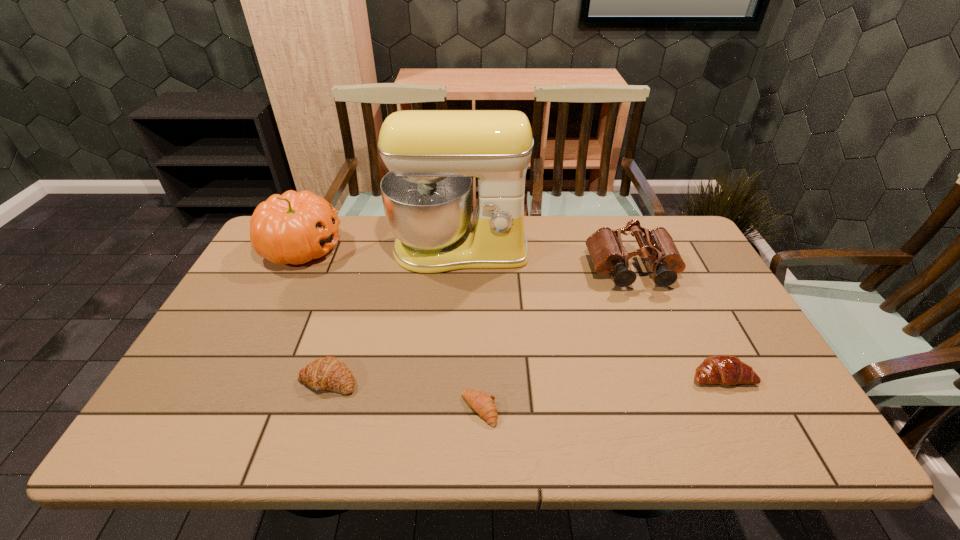
This screenshot has width=960, height=540. Find the location of `the tallest object`. the tallest object is located at coordinates (432, 155).

Locate an element on the screen. This screenshot has width=960, height=540. the fifth shortest object is located at coordinates (293, 228).

Locate an element on the screen. pumpkin is located at coordinates (293, 228).

This screenshot has height=540, width=960. What are the coordinates of `binoculars` in the screenshot? It's located at (608, 254).

Find the location of a particular element. The height and width of the screenshot is (540, 960). the second object from left to right is located at coordinates (329, 373).

Image resolution: width=960 pixels, height=540 pixels. What are the coordinates of `the rightmost crescent roll` in the screenshot? It's located at (720, 369).

Image resolution: width=960 pixels, height=540 pixels. In order to click on the shortest object in this screenshot , I will do `click(483, 404)`.

I want to click on the shortest crescent roll, so click(x=483, y=404).

The height and width of the screenshot is (540, 960). In order to click on free point located 0.210m on the side of the mixer with the control knob in this screenshot , I will do `click(455, 329)`.

Locate an element on the screen. free space located on the carved face of the second tallest object is located at coordinates (443, 248).